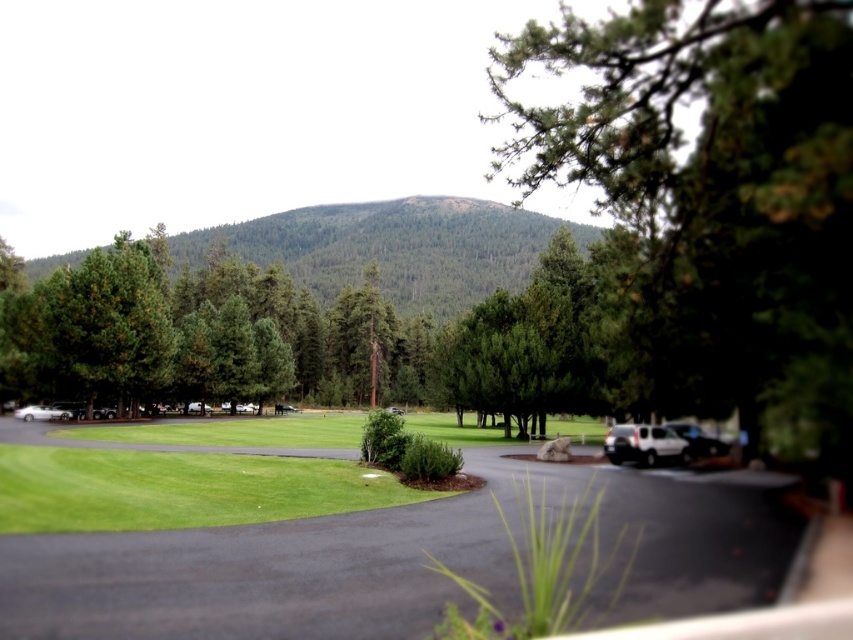
Question: Is green textured tree at upper right further to the viewer compared to green forested mountain at center?

Choices:
 (A) no
 (B) yes

Answer: (A)

Question: Does green grass at center have a smaller size compared to metallic silver car at left?

Choices:
 (A) no
 (B) yes

Answer: (A)

Question: Which of the following is the farthest from the observer?

Choices:
 (A) (64, 413)
 (B) (630, 460)

Answer: (A)

Question: Can you confirm if green forested mountain at center is smaller than metallic silver car at left?

Choices:
 (A) no
 (B) yes

Answer: (A)

Question: Which of the following is the closest to the observer?

Choices:
 (A) green forested mountain at center
 (B) white matte suv at lower right
 (C) metallic silver car at left
 (D) green grass at center

Answer: (D)

Question: Among these points, which one is farthest from the camera?

Choices:
 (A) (343, 248)
 (B) (28, 406)
 (C) (811, 280)
 (D) (639, 440)

Answer: (A)